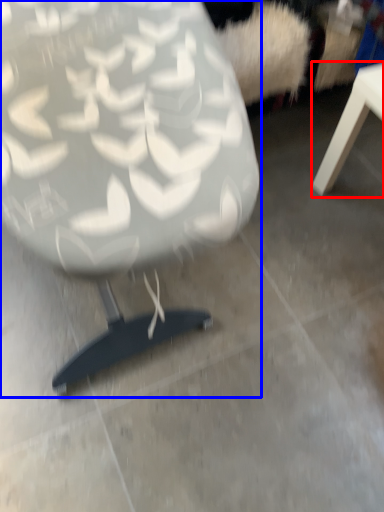
Question: Which object appears farthest to the camera in this image, table (highlighted by a red box) or chair (highlighted by a blue box)?

Choices:
 (A) table
 (B) chair

Answer: (A)